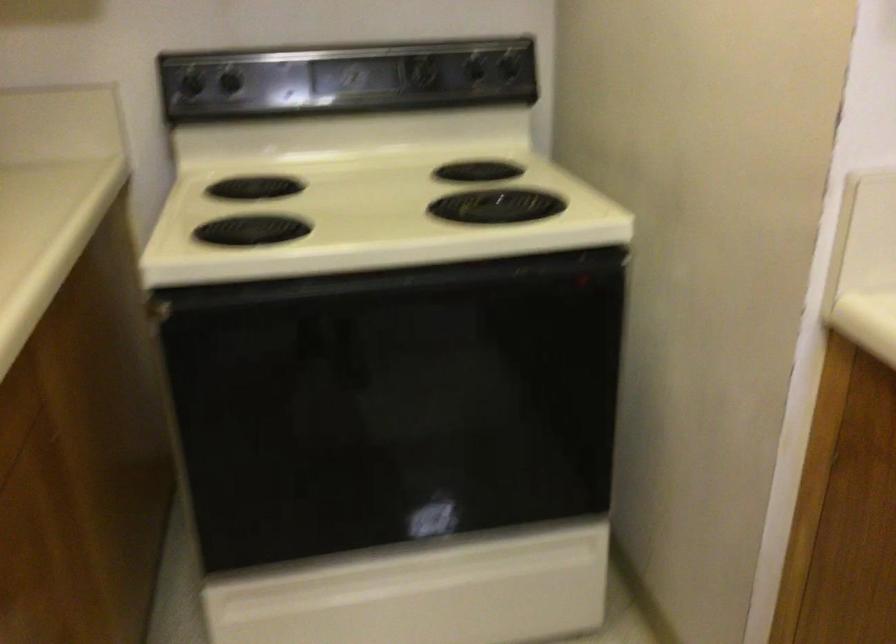
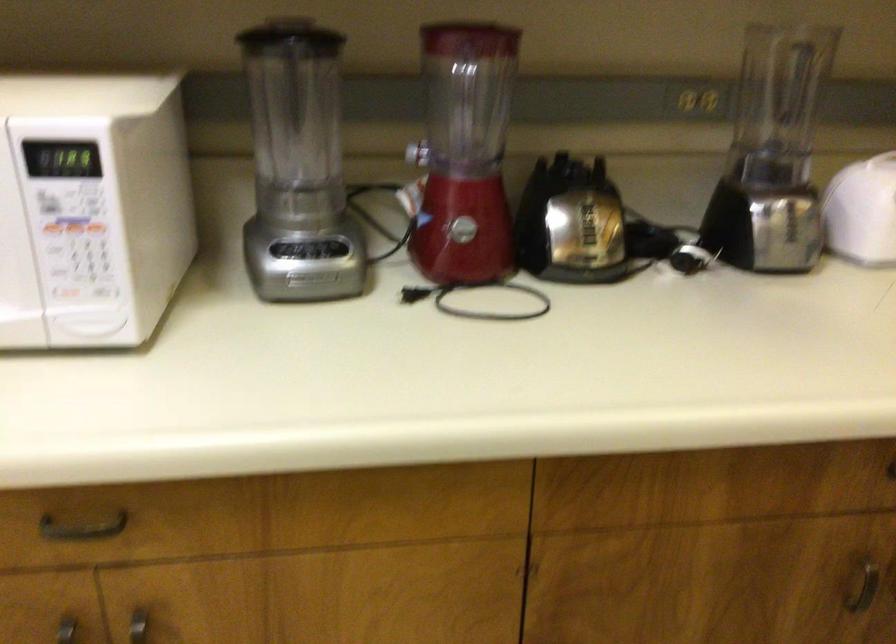
How did the camera likely rotate?

The camera's rotation is toward left-down.